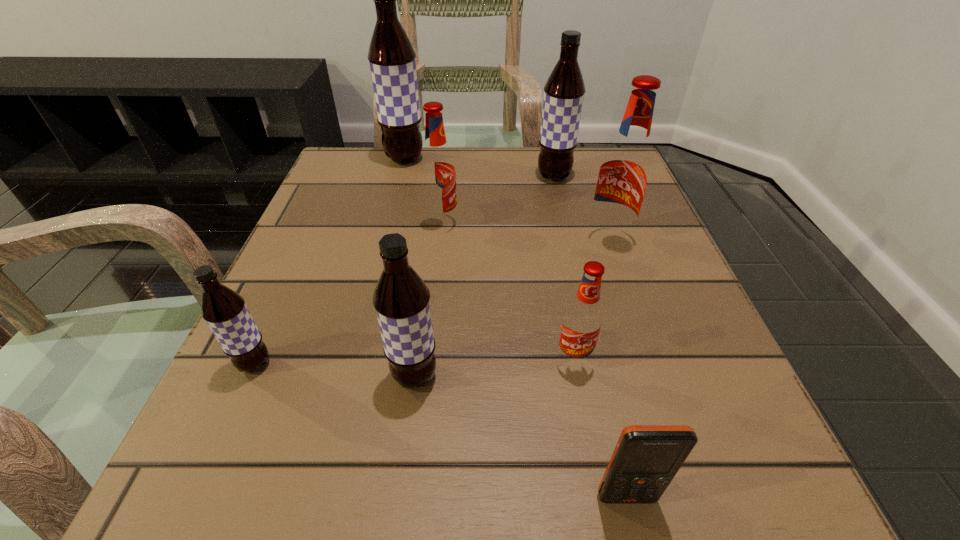
Find the location of `the nearest object`. the nearest object is located at coordinates (646, 458).

The image size is (960, 540). Find the location of `orange cellular telephone`. orange cellular telephone is located at coordinates (646, 458).

Where is `vacant space located 0.320m on the front of the second brown root beer from left to right`? vacant space located 0.320m on the front of the second brown root beer from left to right is located at coordinates (379, 258).

This screenshot has width=960, height=540. What are the coordinates of `vacant space located on the front of the rightmost brown root beer` in the screenshot? It's located at (574, 263).

This screenshot has height=540, width=960. I want to click on vacant region located on the left of the biggest red root beer, so click(x=508, y=241).

Locate an element on the screen. This screenshot has height=540, width=960. blank space located 0.140m on the back of the leftmost red root beer is located at coordinates (446, 178).

Where is `free space located on the right of the third brown root beer from left to right`? This screenshot has width=960, height=540. free space located on the right of the third brown root beer from left to right is located at coordinates (660, 376).

Where is `free space located 0.160m on the right of the second red root beer from right to left`? Image resolution: width=960 pixels, height=540 pixels. free space located 0.160m on the right of the second red root beer from right to left is located at coordinates pos(702,360).

This screenshot has width=960, height=540. In order to click on blank space located on the front of the leftmost root beer in this screenshot , I will do `click(220, 441)`.

Locate an element on the screen. This screenshot has height=540, width=960. object present at the near edge is located at coordinates (646, 458).